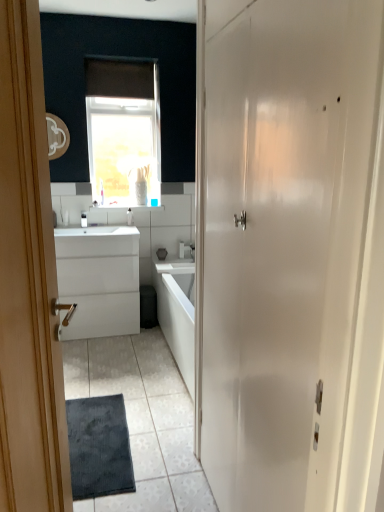
What do you see at coordinates (129, 217) in the screenshot? I see `white plastic toothbrush at upper center, which is counted as the 2th toiletry, starting from the left` at bounding box center [129, 217].

Image resolution: width=384 pixels, height=512 pixels. What do you see at coordinates (187, 250) in the screenshot?
I see `satin nickel faucet at center` at bounding box center [187, 250].

Where is `wooden door at left, which is the second door in right-to-left order`? This screenshot has height=512, width=384. wooden door at left, which is the second door in right-to-left order is located at coordinates (28, 282).

Looking at this image, from a real-world perspective, is white plastic toothbrush at upper center, which ranks as the first toiletry in right-to-left order, positioned under dark gray textured bath mat at lower center based on gravity?

Actually, white plastic toothbrush at upper center, which ranks as the first toiletry in right-to-left order, is physically above dark gray textured bath mat at lower center in the real world.

Which is farther from the camera, (x=129, y=217) or (x=109, y=468)?

The point (x=129, y=217) is more distant.

From the image's perspective, which one is positioned lower, white plastic toothbrush at upper center, which ranks as the first toiletry in right-to-left order, or dark gray textured bath mat at lower center?

dark gray textured bath mat at lower center, from the image's perspective.

From a real-world perspective, is wooden door at left, which appears as the 1th door when viewed from the left, located higher than brown matte window at upper center?

No, from a real-world perspective, wooden door at left, which appears as the 1th door when viewed from the left, is not above brown matte window at upper center.

From the image's perspective, is wooden door at left, which is the second door in right-to-left order, on top of brown matte window at upper center?

Actually, wooden door at left, which is the second door in right-to-left order, appears below brown matte window at upper center in the image.

Which is closer, (15, 298) or (91, 66)?

Clearly, point (15, 298) is closer to the camera than point (91, 66).

The image size is (384, 512). Find the location of `window on the left of the wooden door at left, which appears as the 1th door when viewed from the left`. window on the left of the wooden door at left, which appears as the 1th door when viewed from the left is located at coordinates (123, 131).

From the image's perspective, is white glossy cabinet at center above or below white plastic toothbrush at upper center, which is counted as the 2th toiletry, starting from the left?

Based on their image positions, white glossy cabinet at center is located beneath white plastic toothbrush at upper center, which is counted as the 2th toiletry, starting from the left.

Are white glossy cabinet at center and white plastic toothbrush at upper center, which ranks as the first toiletry in right-to-left order, beside each other?

No, white glossy cabinet at center is not touching white plastic toothbrush at upper center, which ranks as the first toiletry in right-to-left order.

Is white glossy cabinet at center aimed at white plastic toothbrush at upper center, which is counted as the 2th toiletry, starting from the left?

No, white glossy cabinet at center is not aimed at white plastic toothbrush at upper center, which is counted as the 2th toiletry, starting from the left.

Is satin nickel faucet at center next to white plastic toothbrush at upper center, which ranks as the first toiletry in right-to-left order, and touching it?

There is a gap between satin nickel faucet at center and white plastic toothbrush at upper center, which ranks as the first toiletry in right-to-left order.

Is satin nickel faucet at center in front of white plastic toothbrush at upper center, which ranks as the first toiletry in right-to-left order?

That is False.

Is satin nickel faucet at center inside the boundaries of white plastic toothbrush at upper center, which ranks as the first toiletry in right-to-left order, or outside?

satin nickel faucet at center is spatially situated outside white plastic toothbrush at upper center, which ranks as the first toiletry in right-to-left order.

From a real-world perspective, is satin nickel faucet at center positioned over white plastic toothbrush at upper center, which ranks as the first toiletry in right-to-left order, based on gravity?

No, from a real-world perspective, satin nickel faucet at center is not on top of white plastic toothbrush at upper center, which ranks as the first toiletry in right-to-left order.

Is dark gray textured mat at lower left wider than white plastic toothbrush at center, which is the 2th toiletry in right-to-left order?

Yes.

From the image's perspective, is dark gray textured mat at lower left above white plastic toothbrush at center, which is the 2th toiletry in right-to-left order?

Incorrect, from the image's perspective, dark gray textured mat at lower left is lower than white plastic toothbrush at center, which is the 2th toiletry in right-to-left order.

Based on their sizes in the image, would you say dark gray textured mat at lower left is bigger or smaller than white plastic toothbrush at center, which is the 1th toiletry in left-to-right order?

Considering their sizes, dark gray textured mat at lower left takes up more space than white plastic toothbrush at center, which is the 1th toiletry in left-to-right order.

Does dark gray textured mat at lower left appear on the right side of white plastic toothbrush at center, which is the 1th toiletry in left-to-right order?

Indeed, dark gray textured mat at lower left is positioned on the right side of white plastic toothbrush at center, which is the 1th toiletry in left-to-right order.

In the image, there is a white glossy cabinet at center. Identify the location of bath mat below it (from a real-world perspective). (99, 447).

Considering the relative positions of white glossy cabinet at center and dark gray textured bath mat at lower center in the image provided, is white glossy cabinet at center to the right of dark gray textured bath mat at lower center from the viewer's perspective?

No, white glossy cabinet at center is not to the right of dark gray textured bath mat at lower center.

Is white glossy cabinet at center spatially inside dark gray textured bath mat at lower center, or outside of it?

white glossy cabinet at center is located beyond the bounds of dark gray textured bath mat at lower center.

Considering the points (81, 266) and (74, 476), which point is behind, point (81, 266) or point (74, 476)?

Point (81, 266)

Considering the sizes of objects wooden door at left, which is the second door in right-to-left order, and satin nickel faucet at center in the image provided, who is smaller, wooden door at left, which is the second door in right-to-left order, or satin nickel faucet at center?

With smaller size is satin nickel faucet at center.

Who is shorter, wooden door at left, which appears as the 1th door when viewed from the left, or satin nickel faucet at center?

satin nickel faucet at center is shorter.

Is satin nickel faucet at center at the back of wooden door at left, which appears as the 1th door when viewed from the left?

No, wooden door at left, which appears as the 1th door when viewed from the left, is not facing the opposite direction of satin nickel faucet at center.

This screenshot has height=512, width=384. In order to click on the 2nd door positioned below the satin nickel faucet at center (from the image's perspective) in this screenshot , I will do `click(28, 282)`.

From the dark gray textured bath mat at lower center, count the 1st toiletry to the left and point to it. Please provide its 2D coordinates.

[(129, 217)]

The height and width of the screenshot is (512, 384). What are the coordinates of `window above the wooden door at left, which appears as the 1th door when viewed from the left (from a real-world perspective)` in the screenshot? It's located at (123, 131).

Which object lies nearer to the anchor point brown matte window at upper center, white glossy cabinet at center or white plastic toothbrush at center, which is the 1th toiletry in left-to-right order?

Based on the image, white glossy cabinet at center appears to be nearer to brown matte window at upper center.

From the image, which object appears to be nearer to white plastic toothbrush at upper center, which ranks as the first toiletry in right-to-left order, dark gray textured bath mat at lower center or white plastic toothbrush at center, which is the 2th toiletry in right-to-left order?

Among the two, white plastic toothbrush at center, which is the 2th toiletry in right-to-left order, is located nearer to white plastic toothbrush at upper center, which ranks as the first toiletry in right-to-left order.

Estimate the real-world distances between objects in this image. Which object is further from white glossy cabinet at center, white plastic toothbrush at center, which is the 1th toiletry in left-to-right order, or brown matte window at upper center?

Among the two, brown matte window at upper center is located further to white glossy cabinet at center.

Considering their positions, is white glossy cabinet at center positioned further to dark gray textured bath mat at lower center than white glossy sink at center?

Among the two, white glossy sink at center is located further to dark gray textured bath mat at lower center.

Which object lies further to the anchor point dark gray textured mat at lower left, satin nickel faucet at center or white glossy cabinet at center?

satin nickel faucet at center.

From the image, which object appears to be farther from white plastic toothbrush at center, which is the 1th toiletry in left-to-right order, white plastic toothbrush at upper center, which ranks as the first toiletry in right-to-left order, or white glossy cabinet at center?

white glossy cabinet at center lies further to white plastic toothbrush at center, which is the 1th toiletry in left-to-right order, than the other object.

Consider the image. Considering their positions, is white glossy cabinet at center positioned further to brown matte window at upper center than dark gray textured mat at lower left?

dark gray textured mat at lower left is positioned further to the anchor brown matte window at upper center.

Based on their spatial positions, is dark gray textured mat at lower left or wooden door at left, which appears as the 1th door when viewed from the left, further from white glossy door at right, positioned as the second door in left-to-right order?

dark gray textured mat at lower left.

You are a GUI agent. You are given a task and a screenshot of the screen. Output one action in this format:
    pyautogui.click(x=<x>, y=<y>)
    Task: Click on the counter top between brown matte window at upper center and dark gray textured bath mat at lower center in the vertical direction
    Image resolution: width=384 pixels, height=512 pixels.
    Given the screenshot: What is the action you would take?
    pyautogui.click(x=96, y=231)

I want to click on bath mat between white glossy door at right, which ranks as the first door in right-to-left order, and white glossy cabinet at center in the front-back direction, so click(99, 447).

At what (x,y) coordinates should I click in order to perform the action: click on bathroom cabinet between wooden door at left, which is the second door in right-to-left order, and white glossy sink at center, along the z-axis. Please return your answer as a coordinate pair (x, y). Looking at the image, I should click on click(99, 280).

I want to click on counter top between dark gray textured mat at lower left and white plastic toothbrush at upper center, which is counted as the 2th toiletry, starting from the left, along the z-axis, so click(96, 231).